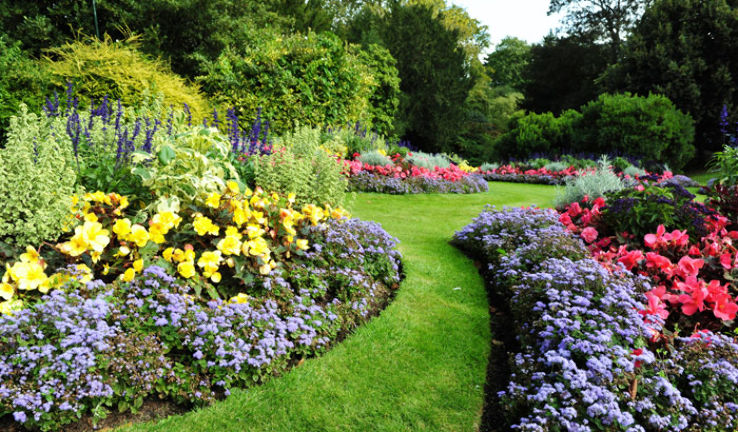
Locate an element on the screen. flower grouping is located at coordinates (644, 282), (162, 267), (441, 168), (522, 159).